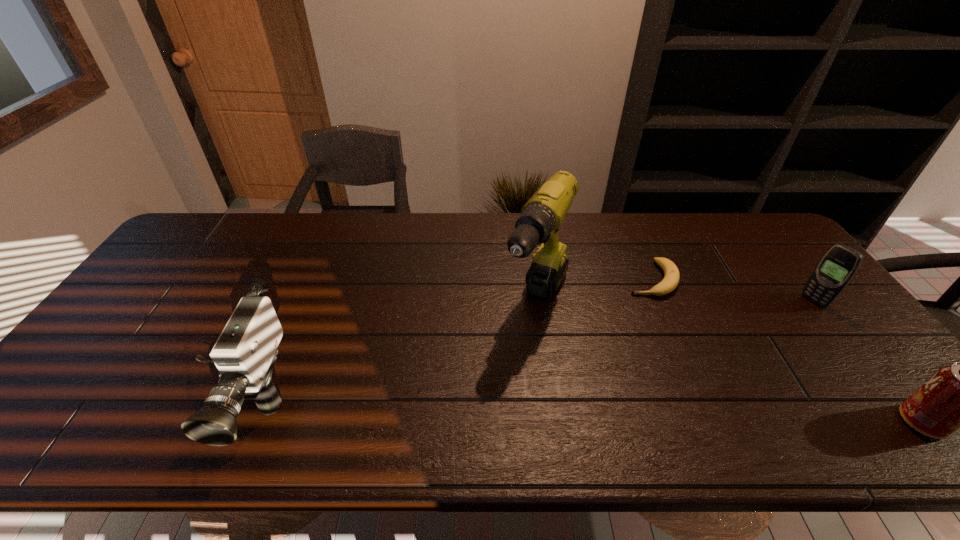
The width and height of the screenshot is (960, 540). What are the coordinates of `vacant area that lies between the cellular telephone and the third object from left to right` in the screenshot? It's located at (732, 291).

The width and height of the screenshot is (960, 540). What are the coordinates of `vacant space that's between the shortest object and the fourth object from right to left` in the screenshot? It's located at (594, 291).

This screenshot has width=960, height=540. In order to click on free area in between the tallest object and the cellular telephone in this screenshot , I will do `click(675, 302)`.

Where is `empty space that is in between the shortest object and the cellular telephone`? The image size is (960, 540). empty space that is in between the shortest object and the cellular telephone is located at coordinates (732, 291).

I want to click on vacant space that's between the tallest object and the second shortest object, so click(x=730, y=362).

Where is `unoccupied position between the cellular telephone and the banana`? Image resolution: width=960 pixels, height=540 pixels. unoccupied position between the cellular telephone and the banana is located at coordinates (732, 291).

Locate an element on the screen. The width and height of the screenshot is (960, 540). free space between the tallest object and the third object from right to left is located at coordinates (594, 291).

Locate an element on the screen. This screenshot has height=540, width=960. empty space between the cellular telephone and the tallest object is located at coordinates (675, 302).

Locate which object ranks in proximity to the cellular telephone. Please provide its 2D coordinates. Your answer should be formatted as a tuple, i.e. [(x, y)], where the tuple contains the x and y coordinates of a point satisfying the conditions above.

[(959, 396)]

Locate an element on the screen. This screenshot has width=960, height=540. the fourth closest object relative to the third object from right to left is located at coordinates (245, 353).